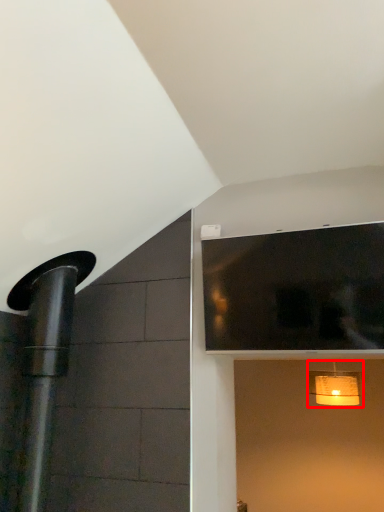
Question: From the image's perspective, what is the correct spatial relationship of light fixture (annotated by the red box) in relation to window?

Choices:
 (A) above
 (B) below

Answer: (B)